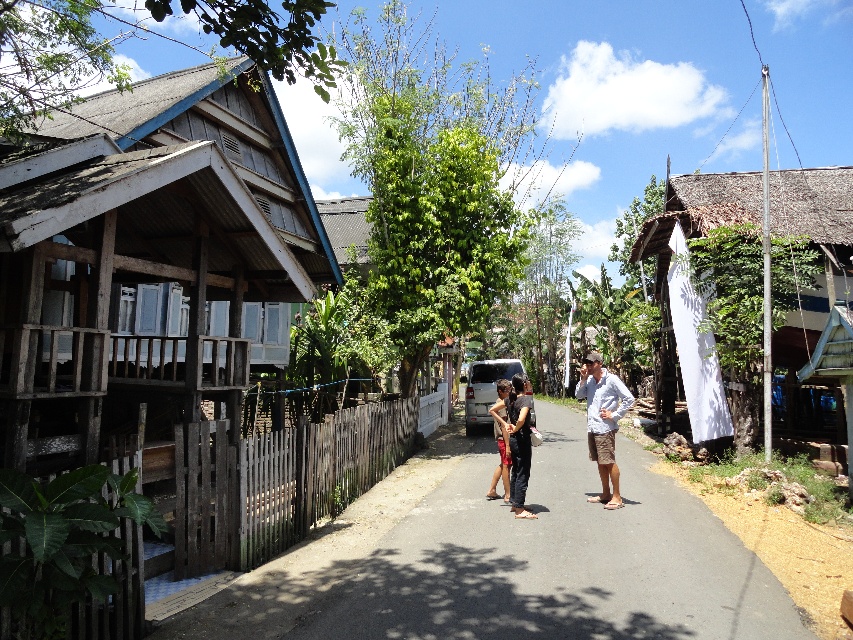
Is wooden fence at lower left smaller than dark gray pants at center?

No, wooden fence at lower left is not smaller than dark gray pants at center.

Is wooden fence at lower left positioned behind dark gray pants at center?

No, it is not.

The width and height of the screenshot is (853, 640). Identify the location of wooden fence at lower left. tap(508, 557).

The height and width of the screenshot is (640, 853). What are the coordinates of `wooden fence at lower left` in the screenshot? It's located at (508, 557).

Who is higher up, light blue shirt at center or dark gray pants at center?

light blue shirt at center is higher up.

Is light blue shirt at center to the left of dark gray pants at center from the viewer's perspective?

In fact, light blue shirt at center is to the right of dark gray pants at center.

At what (x,y) coordinates should I click in order to perform the action: click on light blue shirt at center. Please return your answer as a coordinate pair (x, y). This screenshot has width=853, height=640. Looking at the image, I should click on (602, 422).

The width and height of the screenshot is (853, 640). What do you see at coordinates (508, 557) in the screenshot? I see `wooden fence at lower left` at bounding box center [508, 557].

Is wooden fence at lower left wider than light blue shirt at center?

Correct, the width of wooden fence at lower left exceeds that of light blue shirt at center.

Is point (486, 515) less distant than point (613, 388)?

Yes, point (486, 515) is in front of point (613, 388).

I want to click on wooden fence at lower left, so click(x=508, y=557).